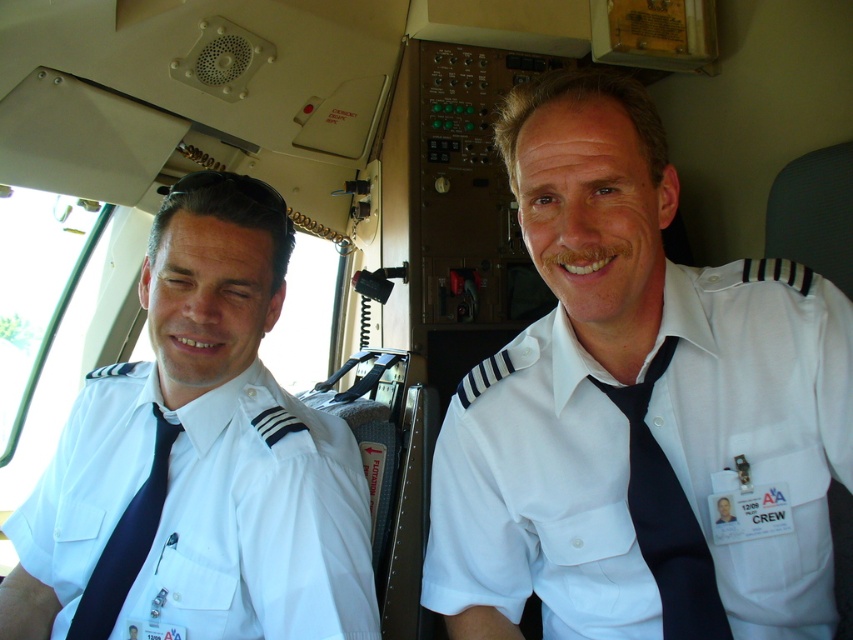
Question: Which of the following is the farthest from the observer?

Choices:
 (A) (653, 573)
 (B) (129, 422)
 (C) (428, 557)

Answer: (B)

Question: Does white cotton shirt at left appear on the left side of black satin tie at center?

Choices:
 (A) no
 (B) yes

Answer: (B)

Question: Does white cotton shirt at left have a greater width compared to matte black tie at left?

Choices:
 (A) no
 (B) yes

Answer: (B)

Question: Considering the relative positions of white cotton shirt at left and matte black tie at left in the image provided, where is white cotton shirt at left located with respect to matte black tie at left?

Choices:
 (A) below
 (B) above

Answer: (B)

Question: Which point appears closest to the camera in this image?

Choices:
 (A) (547, 561)
 (B) (645, 392)
 (C) (165, 486)
 (D) (173, 442)

Answer: (B)

Question: Estimate the real-world distances between objects in this image. Which object is closer to the black satin tie at center?

Choices:
 (A) white cotton shirt at center
 (B) matte black tie at left

Answer: (A)